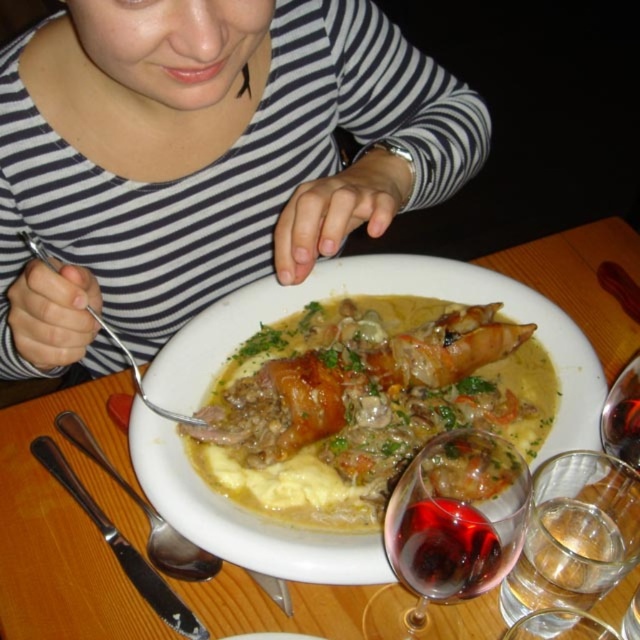
Is striped fabric shirt at upper center to the right of silver spoon at center from the viewer's perspective?

Correct, you'll find striped fabric shirt at upper center to the right of silver spoon at center.

Who is more forward, [332,6] or [280,580]?

Point [280,580]

Is point (104, 212) more distant than point (67, 435)?

Yes, point (104, 212) is farther from viewer.

Locate an element on the screen. This screenshot has height=640, width=640. striped fabric shirt at upper center is located at coordinates pyautogui.click(x=216, y=164).

Does white ceramic plate at center have a smaller size compared to red glass at lower center?

No.

Is white ceramic plate at center positioned at the back of red glass at lower center?

Yes, it is behind red glass at lower center.

Which is behind, point (19, 634) or point (472, 580)?

The point (19, 634) is more distant.

This screenshot has width=640, height=640. Find the location of `white ceramic plate at center`. white ceramic plate at center is located at coordinates (67, 528).

Does striped fabric shirt at upper center have a lesser height compared to transparent glass at lower center?

In fact, striped fabric shirt at upper center may be taller than transparent glass at lower center.

Between point (72, 188) and point (490, 513), which one is positioned behind?

The point (72, 188) is more distant.

In order to click on striped fabric shirt at upper center in this screenshot , I will do `click(216, 164)`.